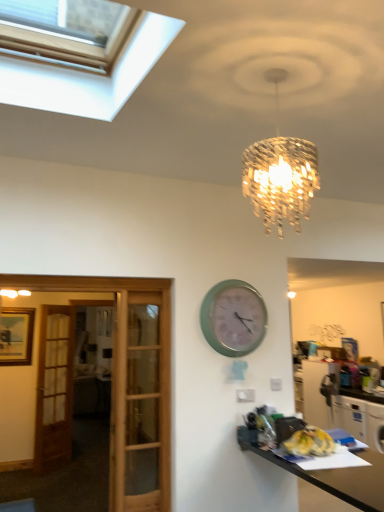
Question: In terms of height, does green matte wall clock at center look taller or shorter compared to black glossy desk at lower right?

Choices:
 (A) tall
 (B) short

Answer: (B)

Question: From the image's perspective, is green matte wall clock at center above or below black glossy desk at lower right?

Choices:
 (A) above
 (B) below

Answer: (A)

Question: Estimate the real-world distances between objects in this image. Which object is closer to the green matte wall clock at center?

Choices:
 (A) white glossy cabinet at lower right
 (B) black glossy desk at lower right
 (C) brown wooden door at left

Answer: (B)

Question: Which object is positioned closest to the green matte wall clock at center?

Choices:
 (A) black glossy desk at lower right
 (B) brown wooden door at left
 (C) white glossy cabinet at lower right

Answer: (A)